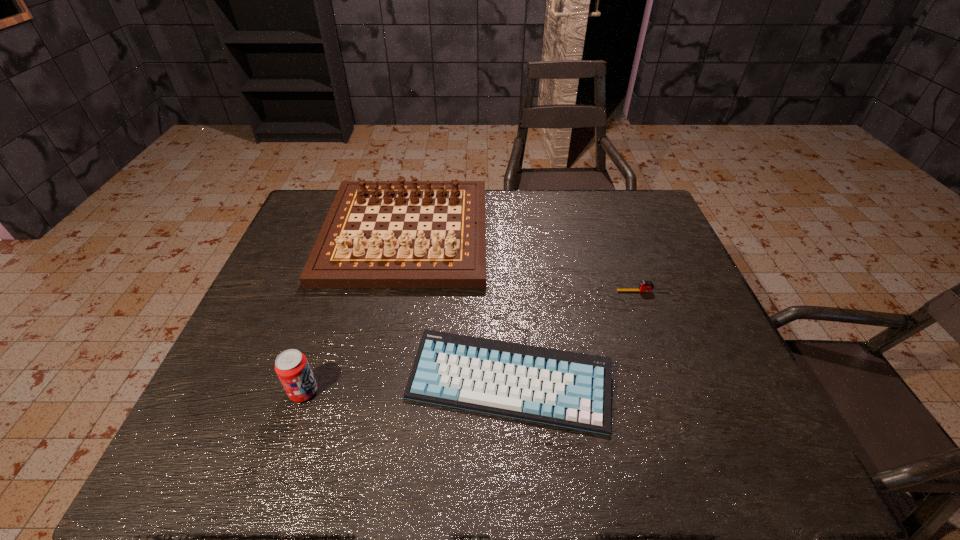
Locate an element on the screen. free space between the gameboard and the rightmost object is located at coordinates (524, 262).

The width and height of the screenshot is (960, 540). Identify the location of free space between the third tallest object and the gameboard. (458, 308).

The height and width of the screenshot is (540, 960). What are the coordinates of `unoccupied position between the tape measure and the gameboard` in the screenshot? It's located at (524, 262).

Locate an element on the screen. The image size is (960, 540). free area in between the shortest object and the second shortest object is located at coordinates (576, 337).

Locate an element on the screen. The height and width of the screenshot is (540, 960). object that stands as the closest to the tape measure is located at coordinates (569, 389).

Find the location of a particular element. Image resolution: width=960 pixels, height=540 pixels. the closest object to the soda can is located at coordinates (569, 389).

I want to click on blank space that satisfies the following two spatial constraints: 1. on the side with the white pieces of the gameboard; 2. on the right side of the computer keyboard, so click(x=375, y=383).

I want to click on vacant space that satisfies the following two spatial constraints: 1. on the side with the white pieces of the gameboard; 2. on the left side of the computer keyboard, so click(375, 383).

This screenshot has height=540, width=960. Find the location of `blank space that satisfies the following two spatial constraints: 1. on the side with the white pieces of the rightmost object; 2. on the left side of the gameboard`. blank space that satisfies the following two spatial constraints: 1. on the side with the white pieces of the rightmost object; 2. on the left side of the gameboard is located at coordinates (395, 292).

This screenshot has height=540, width=960. What are the coordinates of `vacant region that satisfies the following two spatial constraints: 1. on the back side of the computer keyboard; 2. on the right side of the shortest object` in the screenshot? It's located at (504, 292).